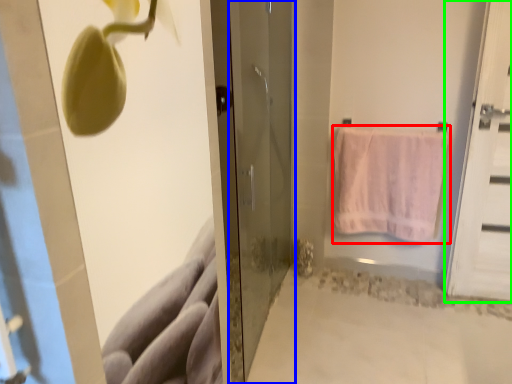
Question: Which object is positioned farthest from towel (highlighted by a red box)? Select from door (highlighted by a blue box) and door (highlighted by a green box).

Choices:
 (A) door
 (B) door

Answer: (A)